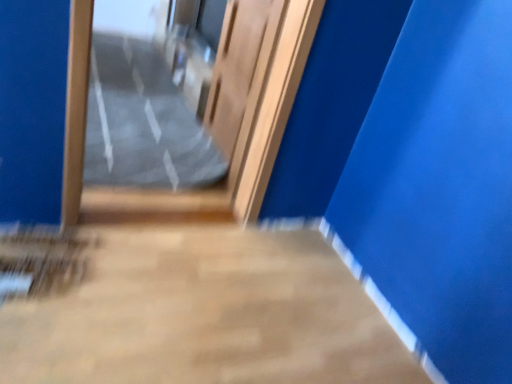
Question: From the image's perspective, is clear plastic bag at center over wooden door at center?

Choices:
 (A) yes
 (B) no

Answer: (A)

Question: Is clear plastic bag at center outside of wooden door at center?

Choices:
 (A) yes
 (B) no

Answer: (A)

Question: Can you confirm if clear plastic bag at center is positioned to the right of wooden door at center?

Choices:
 (A) yes
 (B) no

Answer: (B)

Question: Is clear plastic bag at center aimed at wooden door at center?

Choices:
 (A) no
 (B) yes

Answer: (A)

Question: From a real-world perspective, is clear plastic bag at center physically below wooden door at center?

Choices:
 (A) yes
 (B) no

Answer: (A)

Question: Is wooden door at center taller or shorter than clear plastic bag at center?

Choices:
 (A) short
 (B) tall

Answer: (B)

Question: Based on their sizes in the image, would you say wooden door at center is bigger or smaller than clear plastic bag at center?

Choices:
 (A) big
 (B) small

Answer: (B)

Question: Is wooden door at center in front of or behind clear plastic bag at center in the image?

Choices:
 (A) front
 (B) behind

Answer: (A)

Question: From the image's perspective, is wooden door at center positioned above or below clear plastic bag at center?

Choices:
 (A) above
 (B) below

Answer: (B)

Question: From a real-world perspective, is smooth concrete floor at center physically located above or below clear plastic bag at center?

Choices:
 (A) above
 (B) below

Answer: (B)

Question: Is point (6, 377) closer or farther from the camera than point (157, 112)?

Choices:
 (A) closer
 (B) farther

Answer: (A)

Question: From the image's perspective, is smooth concrete floor at center above or below clear plastic bag at center?

Choices:
 (A) below
 (B) above

Answer: (A)

Question: Choose the correct answer: Is smooth concrete floor at center inside clear plastic bag at center or outside it?

Choices:
 (A) outside
 (B) inside

Answer: (A)

Question: Based on their positions, is wooden door at center located to the left or right of clear plastic bag at center?

Choices:
 (A) right
 (B) left

Answer: (A)

Question: Is wooden door at center inside or outside of clear plastic bag at center?

Choices:
 (A) inside
 (B) outside

Answer: (B)